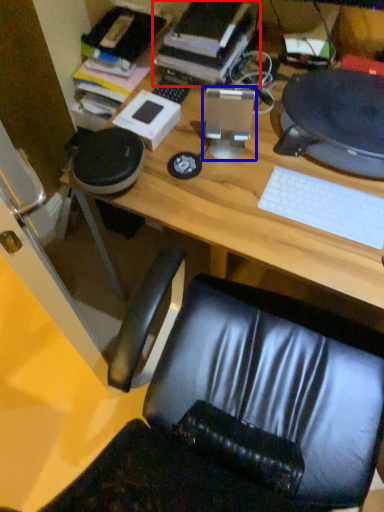
Question: Among these objects, which one is nearest to the camera, book (highlighted by a red box) or desktop computer (highlighted by a blue box)?

Choices:
 (A) book
 (B) desktop computer

Answer: (B)